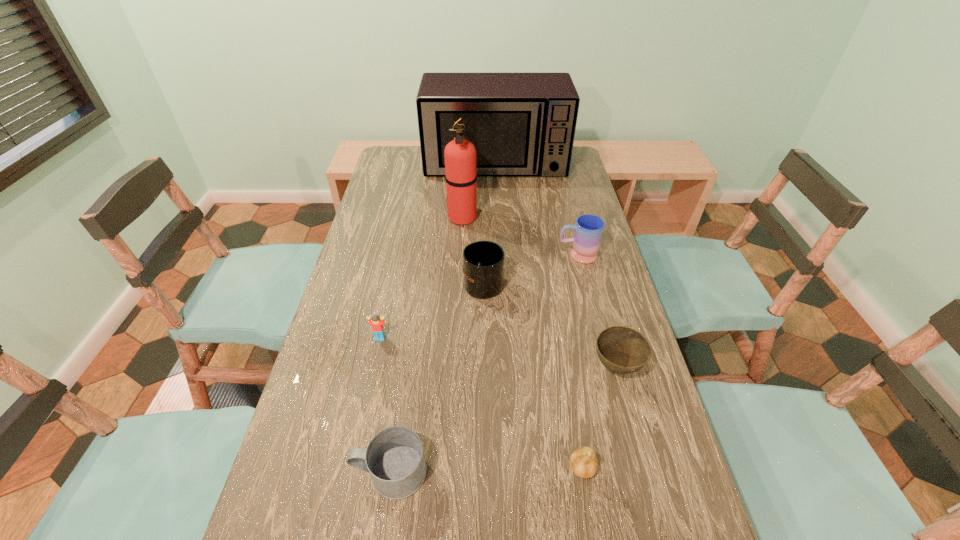
The image size is (960, 540). Identify the location of empty location between the seventh nearest object and the pear. (522, 343).

Where is `unoccupied area between the second mug from right to left and the microwave_oven`? unoccupied area between the second mug from right to left and the microwave_oven is located at coordinates (490, 222).

In order to click on vacant point located between the leftmost mug and the pear in this screenshot , I will do `click(487, 470)`.

I want to click on blank region between the microwave_oven and the pear, so click(539, 316).

Locate which object ranks seventh in proximity to the pear. Please provide its 2D coordinates. Your answer should be formatted as a tuple, i.e. [(x, y)], where the tuple contains the x and y coordinates of a point satisfying the conditions above.

[(522, 124)]

Identify the location of the sixth closest object to the seventh shortest object. (394, 458).

Locate an element on the screen. The width and height of the screenshot is (960, 540). the closest mug to the microwave_oven is located at coordinates (588, 232).

Select which mug appears as the closest to the fourth farthest object. Please provide its 2D coordinates. Your answer should be formatted as a tuple, i.e. [(x, y)], where the tuple contains the x and y coordinates of a point satisfying the conditions above.

[(588, 232)]

Where is `free spot that satisfies the following two spatial constraints: 1. with the handle on the side of the fifth nearest object; 2. at the nozzle of the fire extinguisher`? This screenshot has width=960, height=540. free spot that satisfies the following two spatial constraints: 1. with the handle on the side of the fifth nearest object; 2. at the nozzle of the fire extinguisher is located at coordinates (483, 217).

Find the location of `free location that satisfies the following two spatial constraints: 1. on the back side of the third nearest object; 2. at the nozzle of the seventh nearest object`. free location that satisfies the following two spatial constraints: 1. on the back side of the third nearest object; 2. at the nozzle of the seventh nearest object is located at coordinates (576, 217).